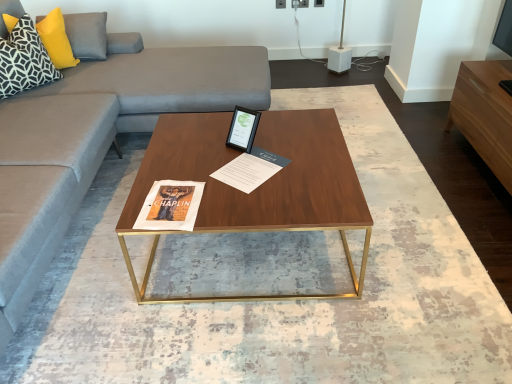
The height and width of the screenshot is (384, 512). What are the coordinates of `vacant space situated on the left part of matte black tablet at center` in the screenshot? It's located at (202, 143).